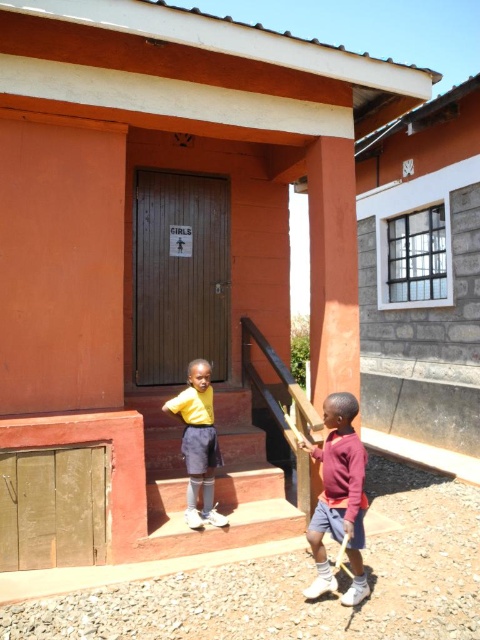
Question: Which object is positioned farthest from the brown wooden stairs at center?

Choices:
 (A) orange matte pillar at upper center
 (B) maroon sweater at lower right

Answer: (A)

Question: Does brown wooden stairs at center appear on the left side of orange matte pillar at upper center?

Choices:
 (A) no
 (B) yes

Answer: (B)

Question: Can you confirm if maroon sweater at lower right is bigger than yellow matte shirt at center?

Choices:
 (A) no
 (B) yes

Answer: (B)

Question: Which of the following is the farthest from the observer?

Choices:
 (A) (350, 435)
 (B) (319, 198)

Answer: (B)

Question: Is orange matte pillar at upper center to the right of maroon sweater at lower right from the viewer's perspective?

Choices:
 (A) no
 (B) yes

Answer: (B)

Question: Which point appears closest to the camera in this image?

Choices:
 (A) (343, 221)
 (B) (212, 513)
 (C) (300, 525)
 (D) (356, 451)

Answer: (D)